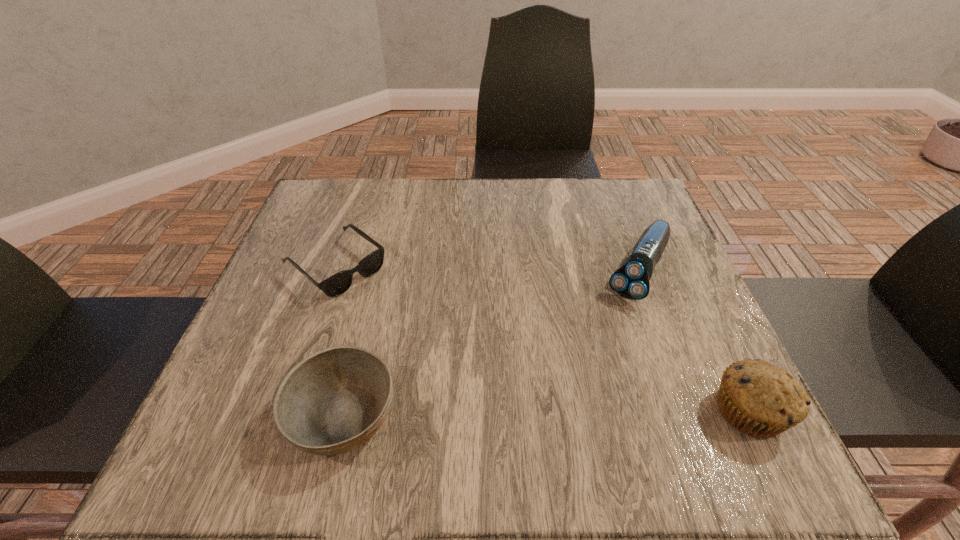
I want to click on free space at the far edge of the desktop, so click(x=507, y=204).

This screenshot has width=960, height=540. Identify the location of free spot at the near edge of the desktop. (400, 409).

The height and width of the screenshot is (540, 960). In the image, there is a desktop. In order to click on vacant space at the left edge in this screenshot , I will do `click(318, 247)`.

Where is `free space at the right edge of the desktop`? The height and width of the screenshot is (540, 960). free space at the right edge of the desktop is located at coordinates (630, 335).

In the image, there is a desktop. In order to click on vacant space at the far left corner in this screenshot , I will do (361, 183).

In the image, there is a desktop. Find the location of `free space at the far right corner`. free space at the far right corner is located at coordinates (645, 213).

Identify the location of vacant space at the near right corner of the desktop. The image size is (960, 540). (646, 382).

I want to click on free space between the second shortest object and the shortest object, so click(340, 340).

The width and height of the screenshot is (960, 540). Find the location of `free space between the third tallest object and the shortest object`. free space between the third tallest object and the shortest object is located at coordinates (340, 340).

Find the location of a particular element. free space between the muffin and the second shortest object is located at coordinates (545, 413).